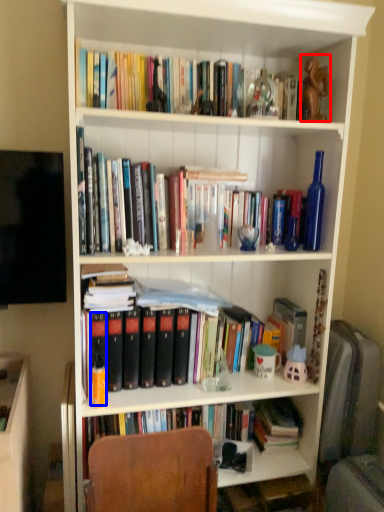
Question: Which object is further to the camera taking this photo, toy (highlighted by a red box) or paperback book (highlighted by a blue box)?

Choices:
 (A) toy
 (B) paperback book

Answer: (A)